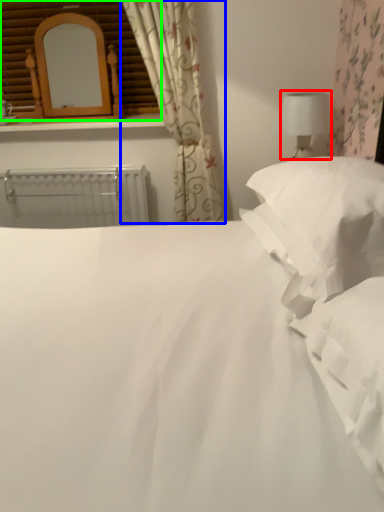
Question: Which object is positioned closest to table lamp (highlighted by a red box)? Select from curtain (highlighted by a blue box) and window frame (highlighted by a green box).

Choices:
 (A) curtain
 (B) window frame

Answer: (A)